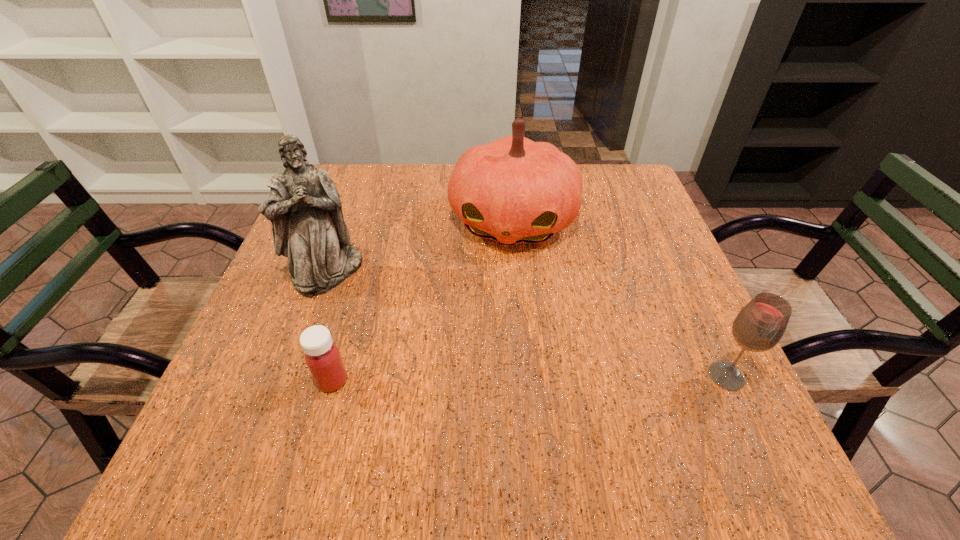
What are the coordinates of `medicine` in the screenshot? It's located at (322, 356).

The height and width of the screenshot is (540, 960). I want to click on the rightmost object, so click(x=759, y=326).

The height and width of the screenshot is (540, 960). I want to click on the third tallest object, so click(x=759, y=326).

Locate an element on the screen. the third object from left to right is located at coordinates (513, 190).

You are a GUI agent. You are given a task and a screenshot of the screen. Output one action in this format:
    pyautogui.click(x=<x>, y=<y>)
    Task: Click on the pumpkin
    The height and width of the screenshot is (540, 960).
    Given the screenshot: What is the action you would take?
    pyautogui.click(x=513, y=190)

This screenshot has height=540, width=960. I want to click on figurine, so click(x=304, y=206).

This screenshot has height=540, width=960. In order to click on free space located 0.290m on the back of the shortest object in this screenshot , I will do pos(366,261).

Identify the location of free space located 0.150m on the back of the glass drink container. (691, 301).

Locate an element on the screen. The height and width of the screenshot is (540, 960). vacant region located on the front-facing side of the second tallest object is located at coordinates (479, 379).

At what (x,y) coordinates should I click in order to perform the action: click on blank space located on the front-facing side of the second tallest object. Please return your answer as a coordinate pair (x, y). Looking at the image, I should click on (490, 327).